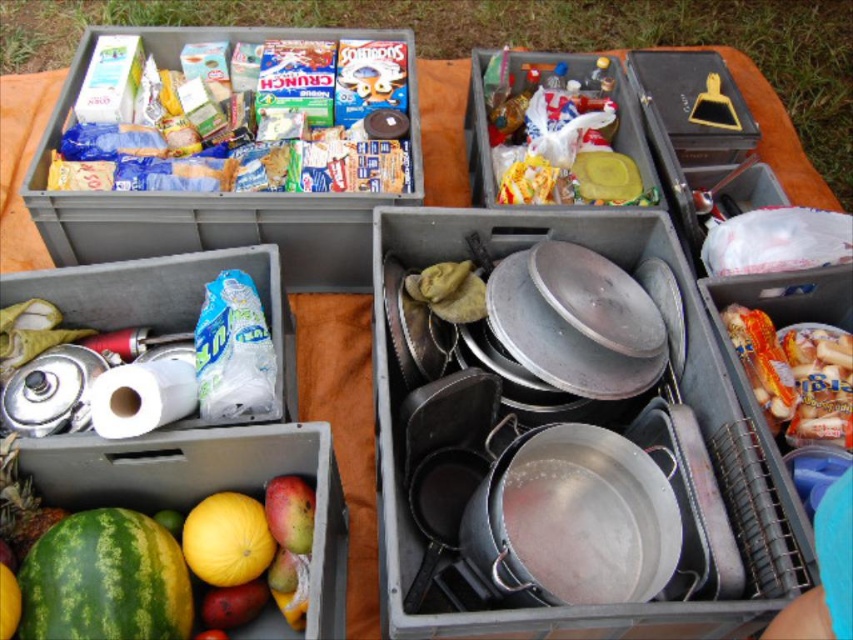
Between point (200, 212) and point (97, 552), which one is positioned behind?

The point (200, 212) is behind.

In the scene shown: Which of these two, matte plastic crate at upper left or green rind watermelon at lower left, stands taller?

matte plastic crate at upper left

Does point (88, 236) come closer to viewer compared to point (138, 515)?

No, (88, 236) is behind (138, 515).

The width and height of the screenshot is (853, 640). Identify the location of matte plastic crate at upper left. (213, 195).

Does green matte watermelon at lower left come behind green rind watermelon at lower left?

That is False.

Is point (320, 508) less distant than point (103, 547)?

No, it is behind (103, 547).

You are a GUI agent. You are given a task and a screenshot of the screen. Output one action in this format:
    pyautogui.click(x=<x>, y=<y>)
    Task: Click on the green matte watermelon at lower left
    Image resolution: width=853 pixels, height=640 pixels.
    Given the screenshot: What is the action you would take?
    pyautogui.click(x=209, y=490)

Is matte plastic crate at upper left to the right of yellow matte melon at lower left from the viewer's perspective?

No, matte plastic crate at upper left is not to the right of yellow matte melon at lower left.

Identify the location of matte plastic crate at upper left. (213, 195).

Locate an element on the screen. This screenshot has height=640, width=853. matte plastic crate at upper left is located at coordinates (213, 195).